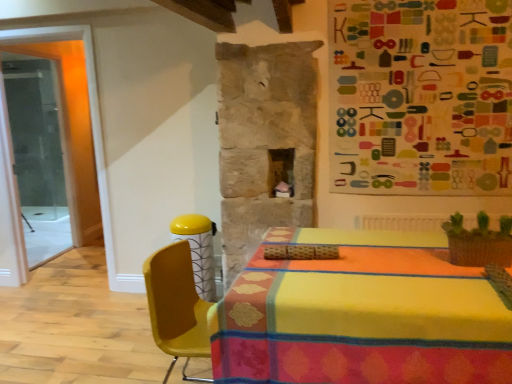
Question: From the image's perspective, would you say transparent glass door at left is positioned over yellow plastic chair at center?

Choices:
 (A) no
 (B) yes

Answer: (B)

Question: Can you confirm if transparent glass door at left is thinner than yellow plastic chair at center?

Choices:
 (A) no
 (B) yes

Answer: (B)

Question: From a real-world perspective, is transparent glass door at left physically below yellow plastic chair at center?

Choices:
 (A) no
 (B) yes

Answer: (A)

Question: Considering the relative sizes of transparent glass door at left and yellow plastic chair at center in the image provided, is transparent glass door at left taller than yellow plastic chair at center?

Choices:
 (A) no
 (B) yes

Answer: (B)

Question: From the image's perspective, is transparent glass door at left beneath yellow plastic chair at center?

Choices:
 (A) no
 (B) yes

Answer: (A)

Question: Would you say transparent glass door at left is to the left or to the right of yellow plastic chair at center in the picture?

Choices:
 (A) right
 (B) left

Answer: (B)

Question: From their relative heights in the image, would you say transparent glass door at left is taller or shorter than yellow plastic chair at center?

Choices:
 (A) tall
 (B) short

Answer: (A)

Question: Considering their positions, is transparent glass door at left located in front of or behind yellow plastic chair at center?

Choices:
 (A) behind
 (B) front

Answer: (A)

Question: Is transparent glass door at left inside the boundaries of yellow plastic chair at center, or outside?

Choices:
 (A) inside
 (B) outside

Answer: (B)

Question: Is multicolored fabric bulletin board at upper right to the left or to the right of transparent glass door at left in the image?

Choices:
 (A) left
 (B) right

Answer: (B)

Question: Choose the correct answer: Is multicolored fabric bulletin board at upper right inside transparent glass door at left or outside it?

Choices:
 (A) outside
 (B) inside

Answer: (A)

Question: From a real-world perspective, relative to transparent glass door at left, is multicolored fabric bulletin board at upper right vertically above or below?

Choices:
 (A) above
 (B) below

Answer: (A)

Question: In terms of size, does multicolored fabric bulletin board at upper right appear bigger or smaller than transparent glass door at left?

Choices:
 (A) big
 (B) small

Answer: (B)

Question: Considering the relative positions of yellow plastic chair at center and transparent glass door at left in the image provided, is yellow plastic chair at center to the left or to the right of transparent glass door at left?

Choices:
 (A) right
 (B) left

Answer: (A)

Question: Is point (173, 304) closer or farther from the camera than point (62, 170)?

Choices:
 (A) farther
 (B) closer

Answer: (B)